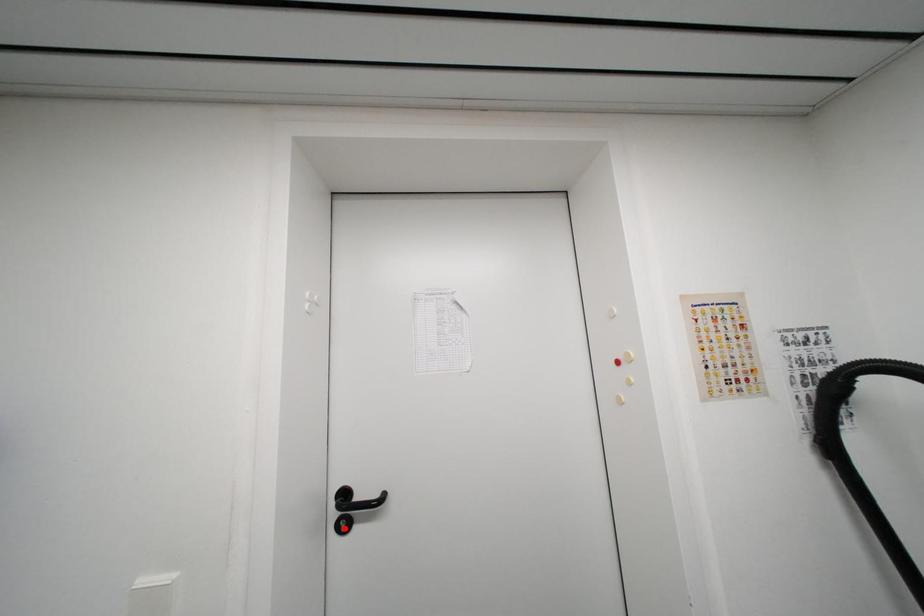
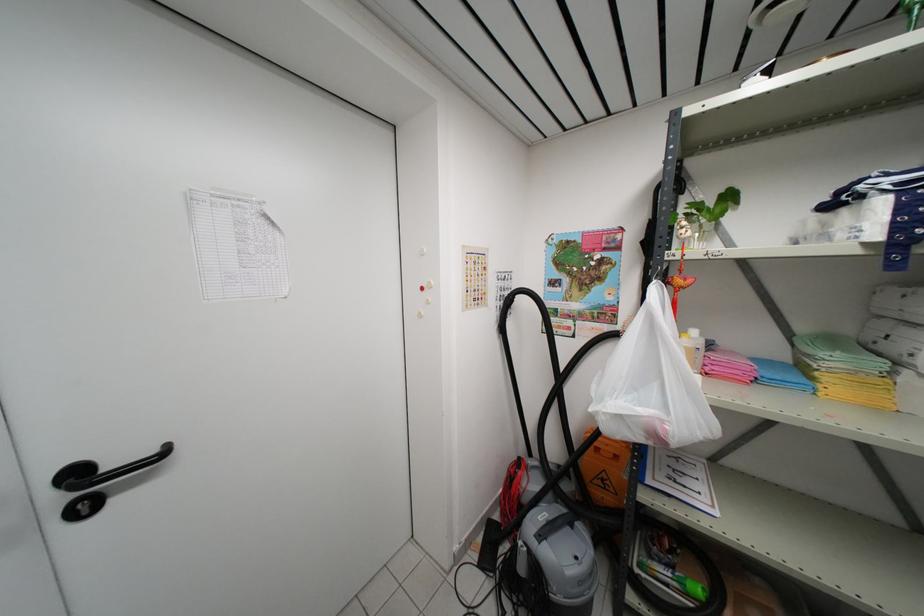
Question: I am providing you with two images of the same scene from different viewpoints. In image1, a red point is highlighted. Considering the same 3D point in image2, which of the following is correct?

Choices:
 (A) It is closer
 (B) It is farther

Answer: (A)